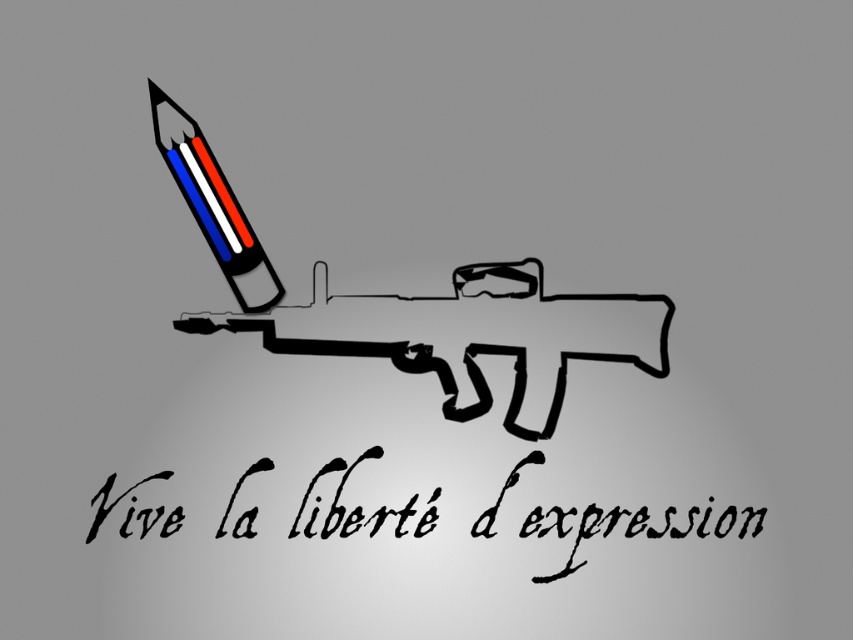
Between point (465, 353) and point (192, 134), which one is positioned behind?

The point (465, 353) is more distant.

In the scene shown: Does matte black gun at center have a smaller size compared to matte plastic pencil at upper left?

No.

Measure the distance between point (486, 396) and camera.

3.54 feet

You are a GUI agent. You are given a task and a screenshot of the screen. Output one action in this format:
    pyautogui.click(x=<x>, y=<y>)
    Task: Click on the matte black gun at center
    This screenshot has width=853, height=640.
    Given the screenshot: What is the action you would take?
    pyautogui.click(x=465, y=346)

Which is more to the left, black calligraphy at lower center or matte plastic pencil at upper left?

From the viewer's perspective, matte plastic pencil at upper left appears more on the left side.

Between point (131, 532) and point (202, 227), which one is positioned behind?

Point (202, 227)

Which is behind, point (396, 525) or point (247, 228)?

The point (247, 228) is behind.

Where is `black calligraphy at lower center`? black calligraphy at lower center is located at coordinates (634, 525).

Can you confirm if black calligraphy at lower center is wider than matte black gun at center?

Yes, black calligraphy at lower center is wider than matte black gun at center.

Based on the photo, who is more distant from viewer, (715, 534) or (265, 320)?

Positioned behind is point (265, 320).

This screenshot has width=853, height=640. In order to click on black calligraphy at lower center in this screenshot , I will do `click(634, 525)`.